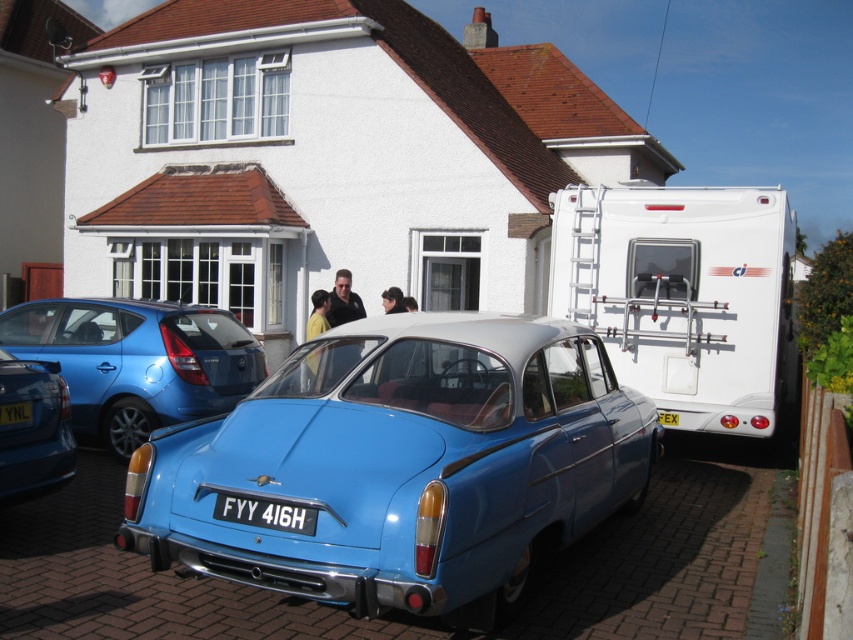
Can you confirm if matte blue sedan at left is positioned to the right of blue metallic license plate at center?

No, matte blue sedan at left is not to the right of blue metallic license plate at center.

Between point (106, 321) and point (264, 506), which one is positioned behind?

The point (106, 321) is more distant.

Does point (107, 394) lie behind point (286, 509)?

That is True.

Image resolution: width=853 pixels, height=640 pixels. I want to click on matte blue sedan at left, so click(x=137, y=362).

Which of these two, blue matte car at center or yellowmaterial/texturelicense plate at center, stands shorter?

yellowmaterial/texturelicense plate at center is shorter.

Based on the photo, is blue matte car at center below yellowmaterial/texturelicense plate at center?

No, blue matte car at center is not below yellowmaterial/texturelicense plate at center.

Is point (480, 376) positioned before point (660, 413)?

Yes.

The height and width of the screenshot is (640, 853). What are the coordinates of `blue matte car at center` in the screenshot? It's located at (404, 465).

Is matte blue sedan at left in front of yellowmaterial/texturelicense plate at center?

Yes, it is.

Between matte blue sedan at left and yellowmaterial/texturelicense plate at center, which one is positioned lower?

yellowmaterial/texturelicense plate at center

Is point (132, 428) positioned after point (672, 424)?

No, it is in front of (672, 424).

Locate an element on the screen. This screenshot has width=853, height=640. matte blue sedan at left is located at coordinates (x=137, y=362).